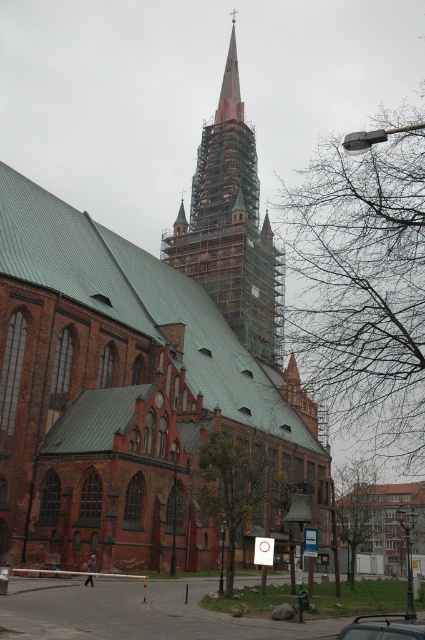
You are a photographer planning to capture the brown brick church at center and the metallic silver car at center in a single frame. Which object will occupy more horizontal space in the photo?

The brown brick church at center has a greater width than the metallic silver car at center, so it will occupy more horizontal space in the photo.

You are standing at point A, which is located at coordinates (144, 369). What is the closest object to you?

The closest object to you at point A is the brown brick church at center, as it is located precisely at the coordinates provided.

You are a construction worker standing at the base of the brown brick church at center. You need to access the wooden scaffolding at center to continue your work. Which direction should you move to reach the scaffolding?

The wooden scaffolding at center is above the brown brick church at center, so you should move upward to reach it.